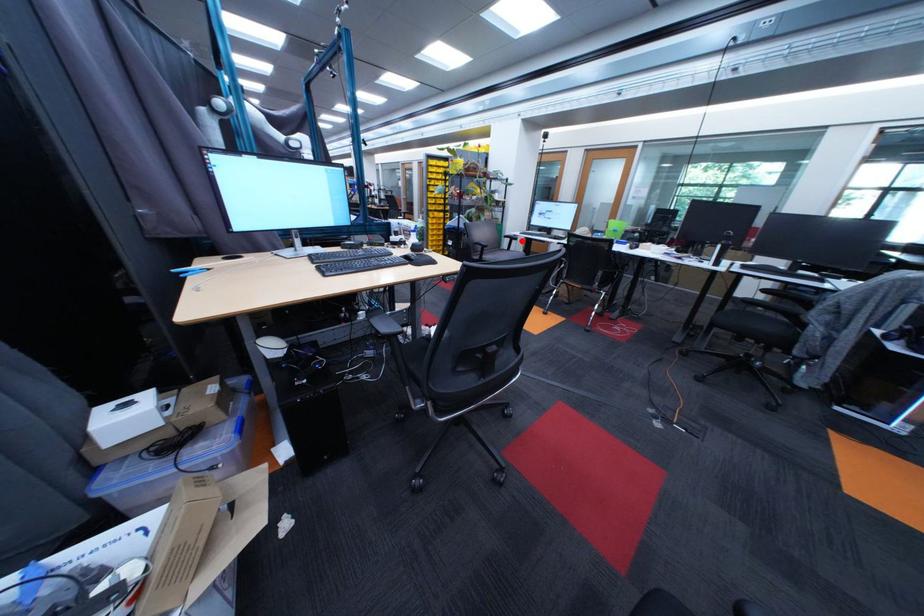
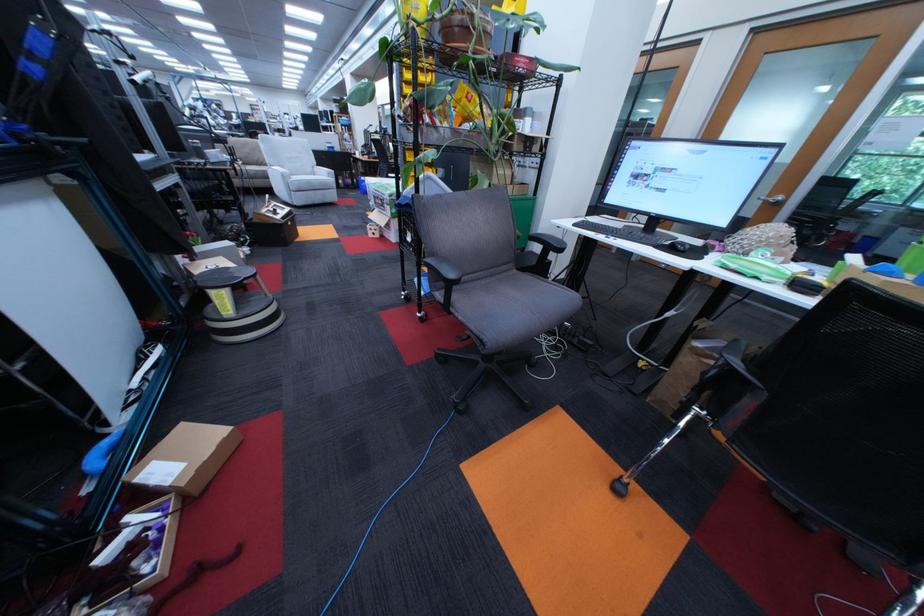
Where in the second image is the point corresponding to the highlighted location from the first image?

(552, 249)